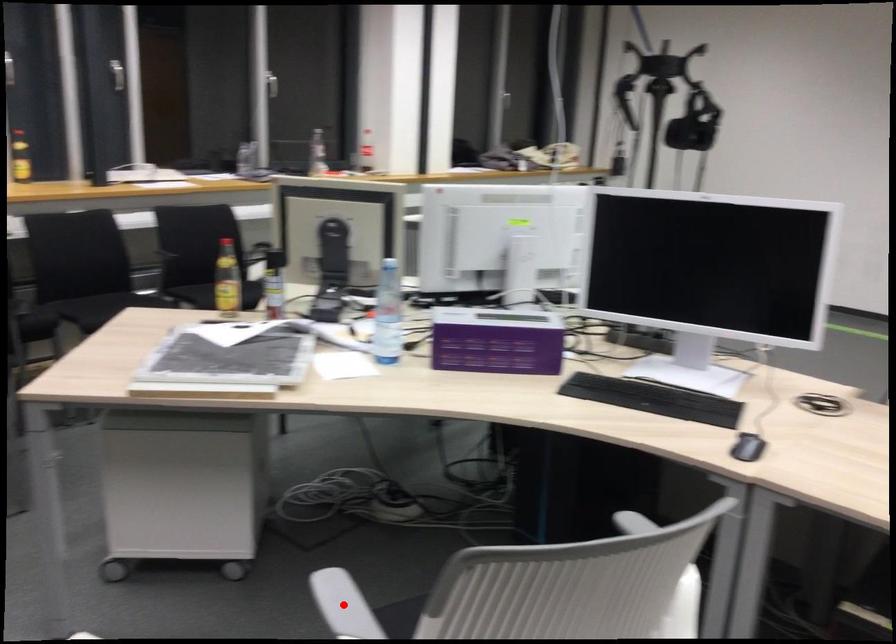
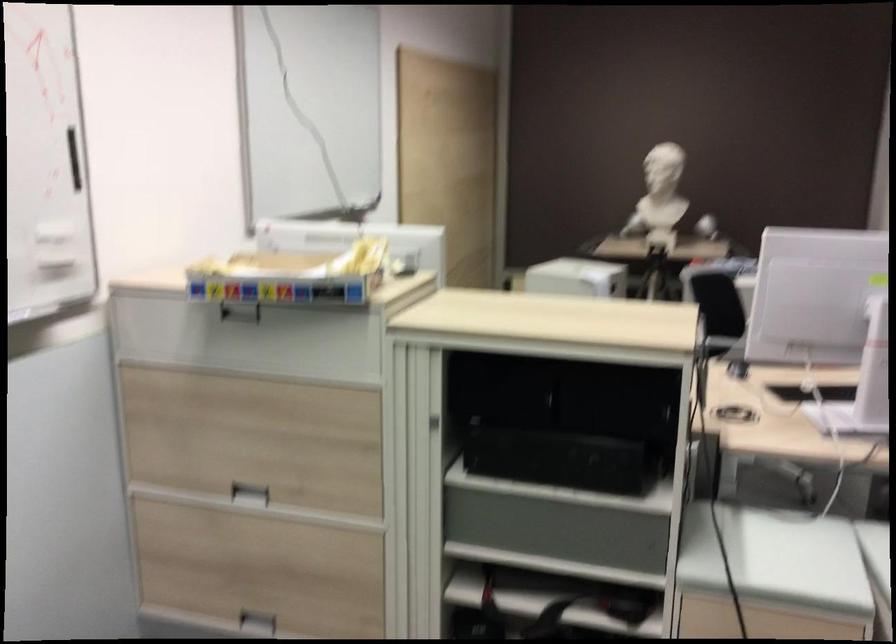
Question: I am providing you with two images of the same scene from different viewpoints. A red point is marked on the first image. Is the red point's position out of view in image 2?

Choices:
 (A) Yes
 (B) No

Answer: (A)